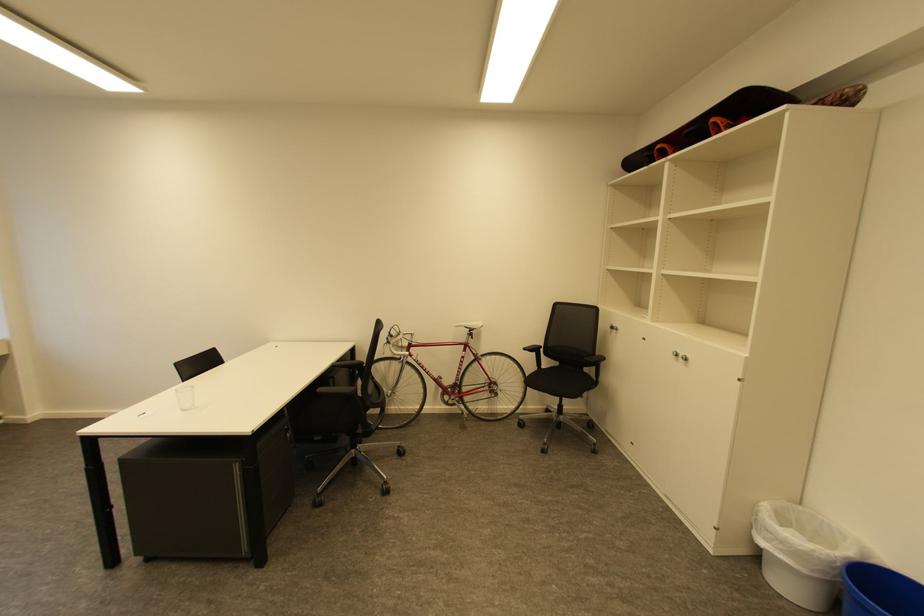
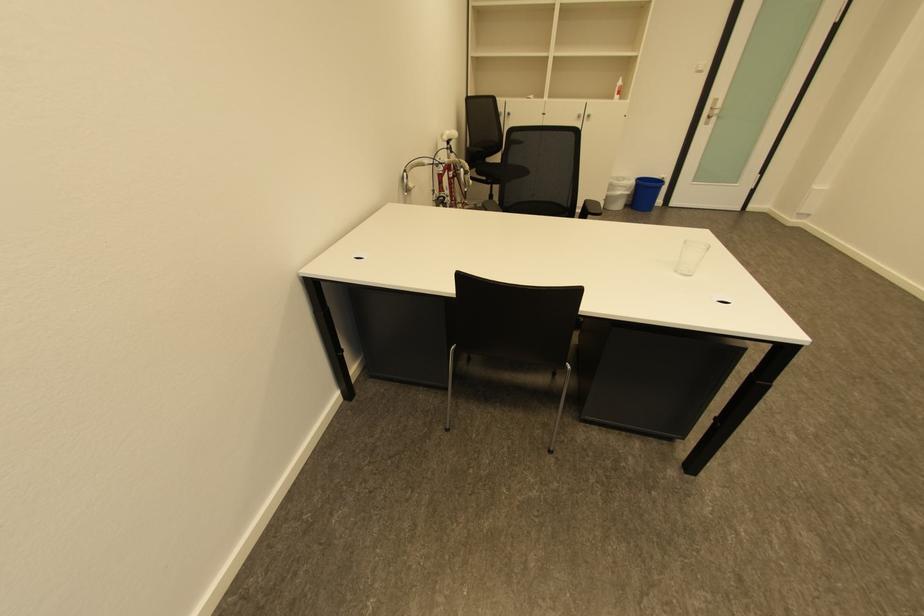
In the second image, find the point that corresponds to point (775, 533) in the first image.

(626, 188)